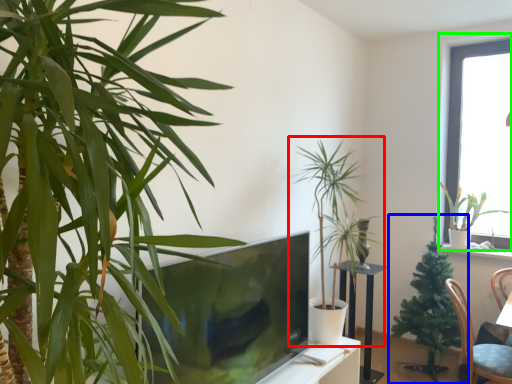
Question: Which object is positioned farthest from houseplant (highlighted by a red box)? Select from houseplant (highlighted by a blue box) and window (highlighted by a green box).

Choices:
 (A) houseplant
 (B) window

Answer: (B)